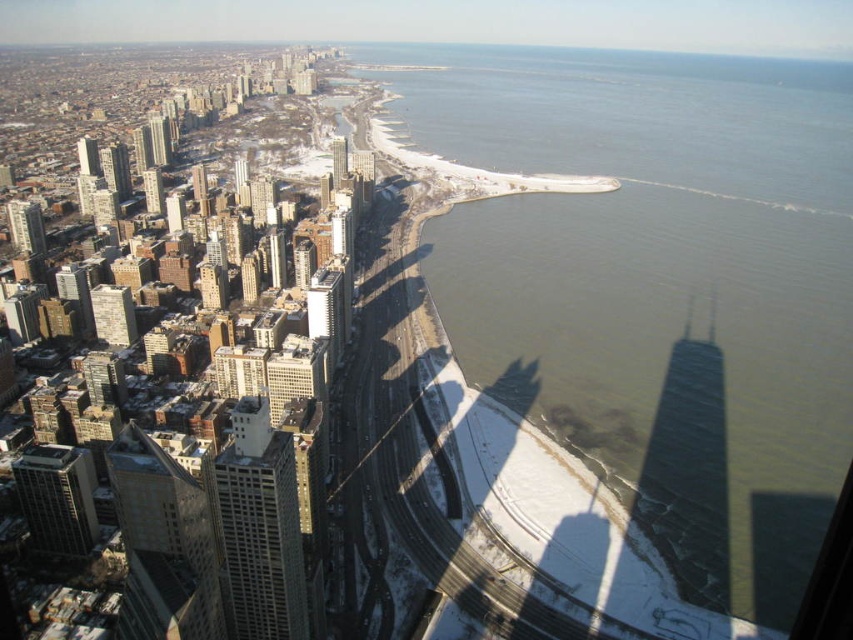
Question: Which point is farther to the camera?

Choices:
 (A) (187, 344)
 (B) (154, 474)

Answer: (A)

Question: Is greenish water at center right wider than matte glass skyscraper at center?

Choices:
 (A) no
 (B) yes

Answer: (B)

Question: Is greenish water at center right above gray concrete building at lower left?

Choices:
 (A) yes
 (B) no

Answer: (A)

Question: Which point appears closest to the camera in this image?

Choices:
 (A) (39, 541)
 (B) (146, 632)

Answer: (B)

Question: Estimate the real-world distances between objects in this image. Which object is farther from the light gray concrete skyscraper at center-left?

Choices:
 (A) gray concrete skyscraper at left
 (B) matte glass skyscraper at center
 (C) gray concrete building at lower left
 (D) greenish water at center right

Answer: (D)

Question: Is greenish water at center right below light gray concrete skyscraper at center-left?

Choices:
 (A) no
 (B) yes

Answer: (A)